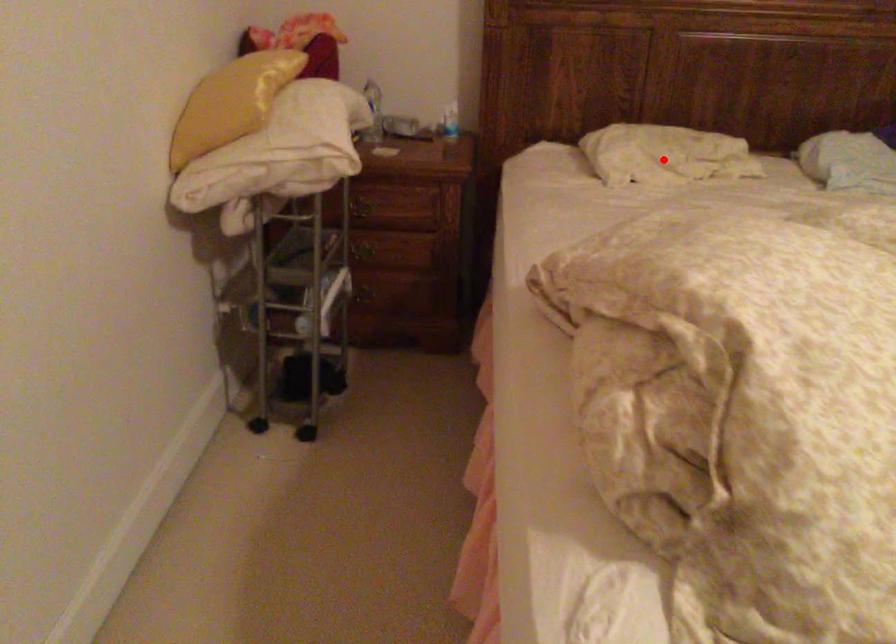
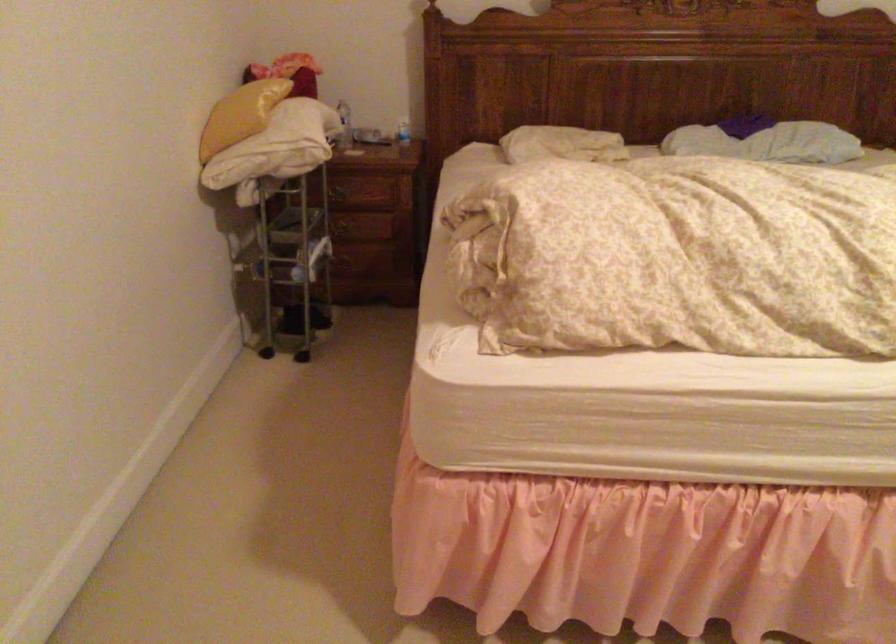
Where in the second image is the point corresponding to the highlighted location from the first image?

(561, 144)